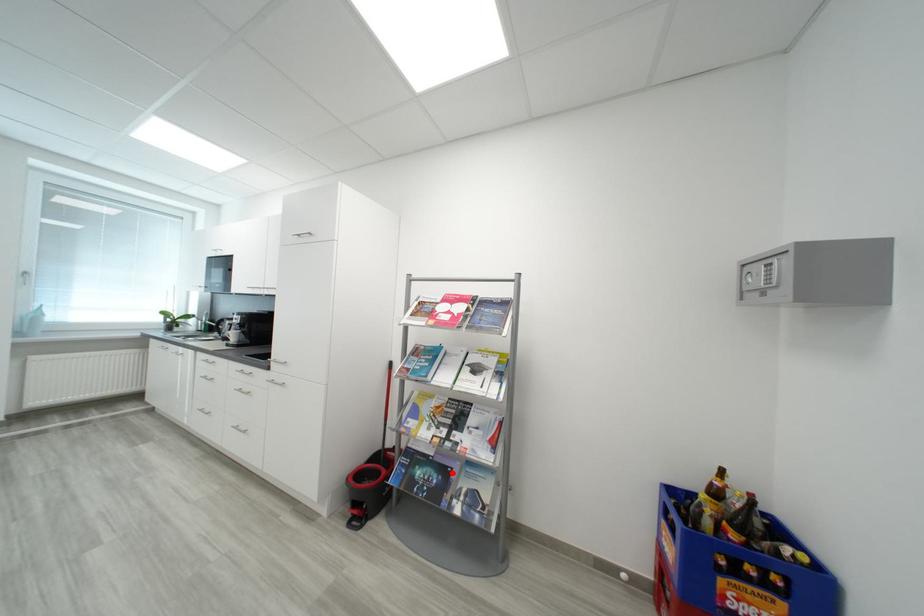
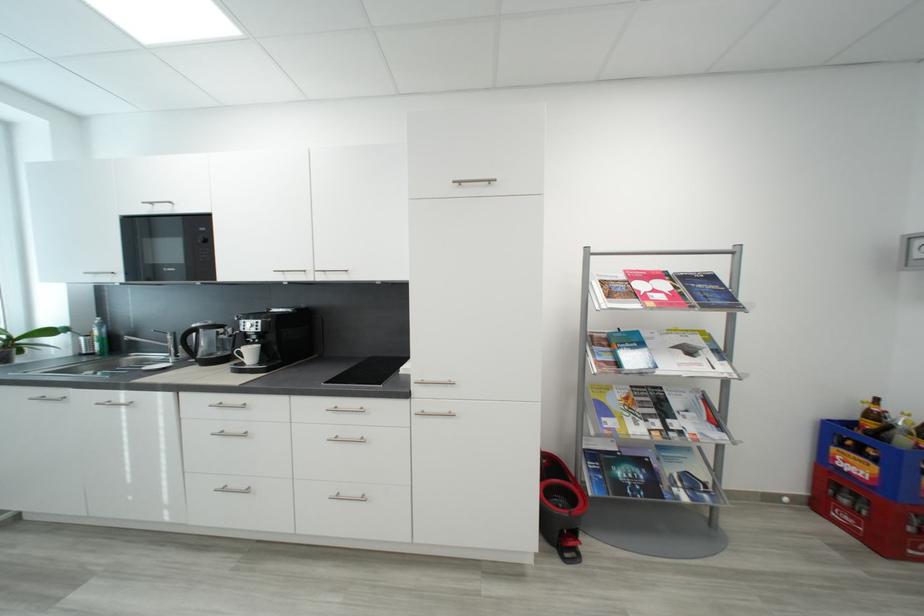
Where in the second image is the point corresponding to the highlighted location from the first image?

(650, 464)